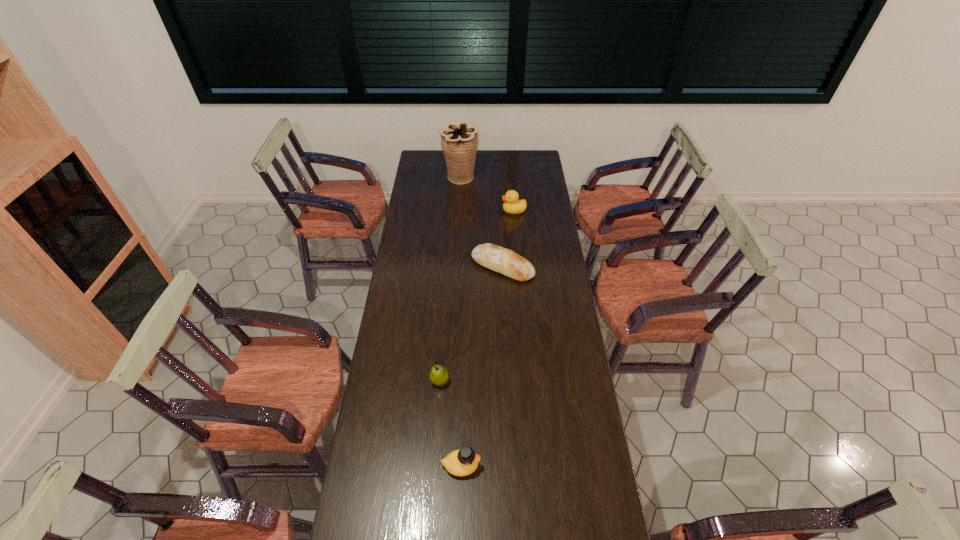
The height and width of the screenshot is (540, 960). I want to click on free space at the far right corner of the desktop, so click(x=518, y=171).

Identify the location of vacant area that lies between the urn and the fourth farthest object. (450, 279).

The image size is (960, 540). Identify the location of blank region between the pear and the bread. (471, 324).

The image size is (960, 540). What are the coordinates of `free space between the pear and the tallest object` in the screenshot? It's located at (450, 279).

Where is `free space between the farthest object and the nearer duck`? The image size is (960, 540). free space between the farthest object and the nearer duck is located at coordinates (461, 322).

This screenshot has height=540, width=960. Identify the location of unoccupied area between the pear and the nearest object. point(450,423).

In order to click on free spot between the left duck and the farthest object in this screenshot , I will do `click(461, 322)`.

The image size is (960, 540). Find the location of `free point between the farthest object and the nearer duck`. free point between the farthest object and the nearer duck is located at coordinates click(461, 322).

Select which object is the fourth closest to the second nearest object. Please provide its 2D coordinates. Your answer should be formatted as a tuple, i.e. [(x, y)], where the tuple contains the x and y coordinates of a point satisfying the conditions above.

[(459, 141)]

Locate an element on the screen. Image resolution: width=960 pixels, height=540 pixels. object that is the third closest to the third nearest object is located at coordinates (459, 141).